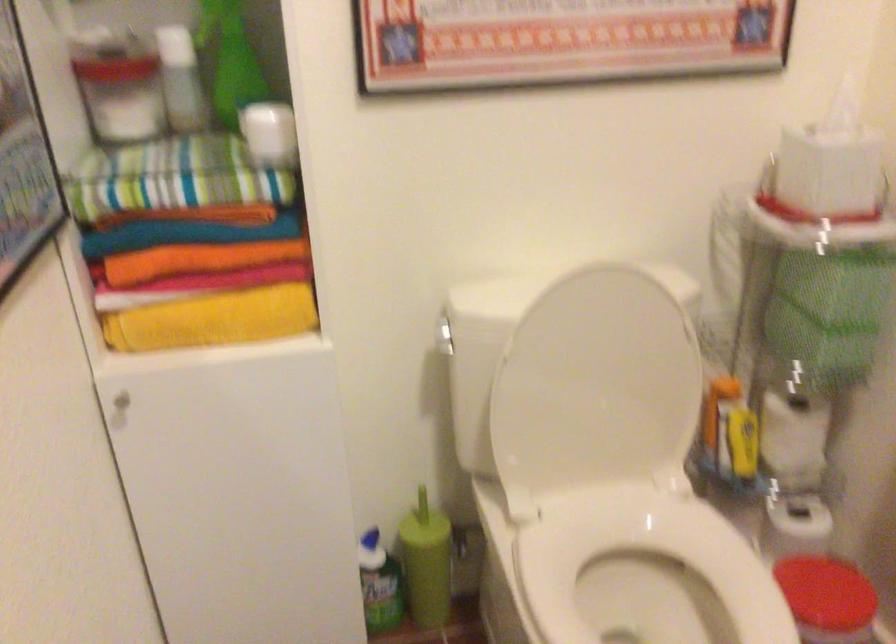
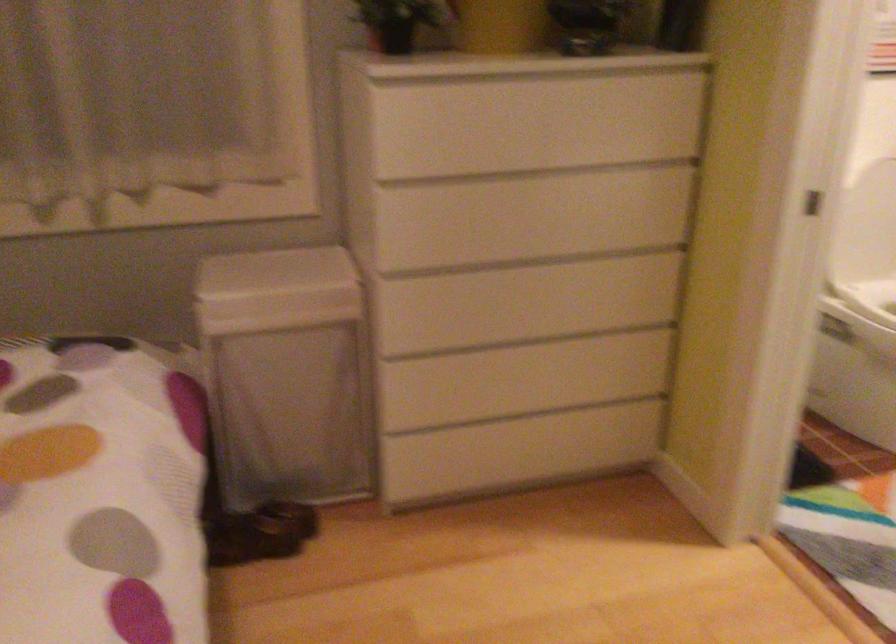
In a continuous first-person perspective shot, in which direction is the camera moving?

The movement direction of the cameraman is left, backward.